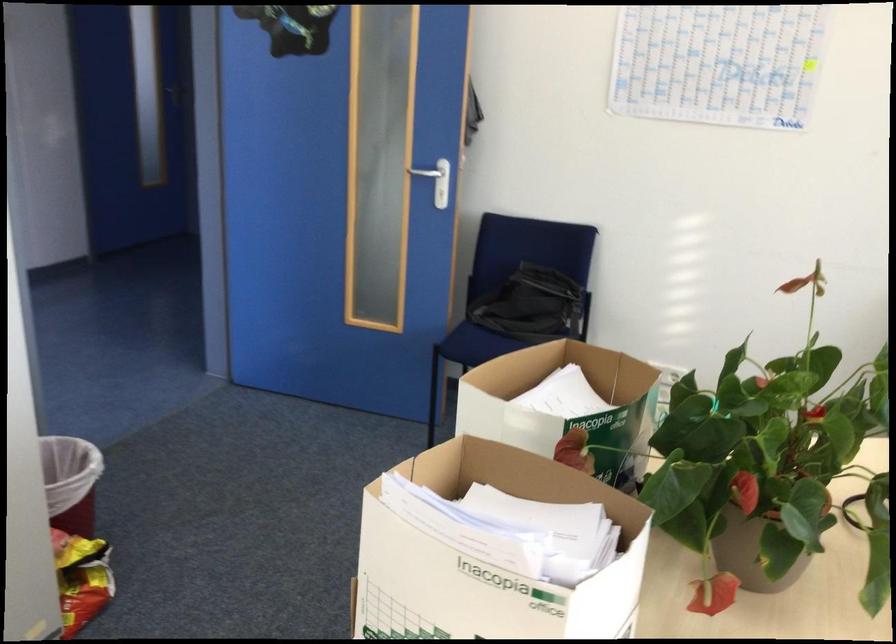
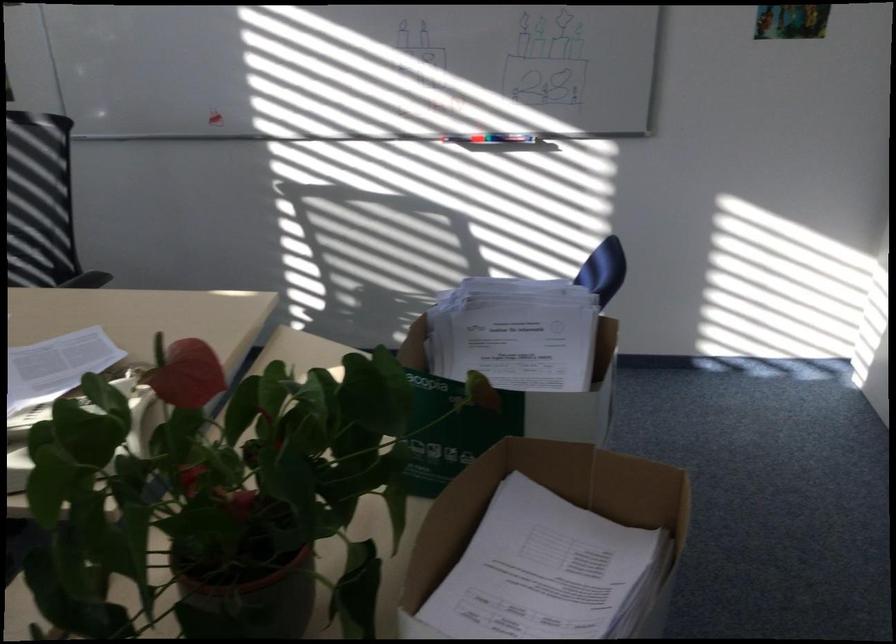
The point at (691, 437) is marked in the first image. Where is the corresponding point in the second image?

(262, 597)